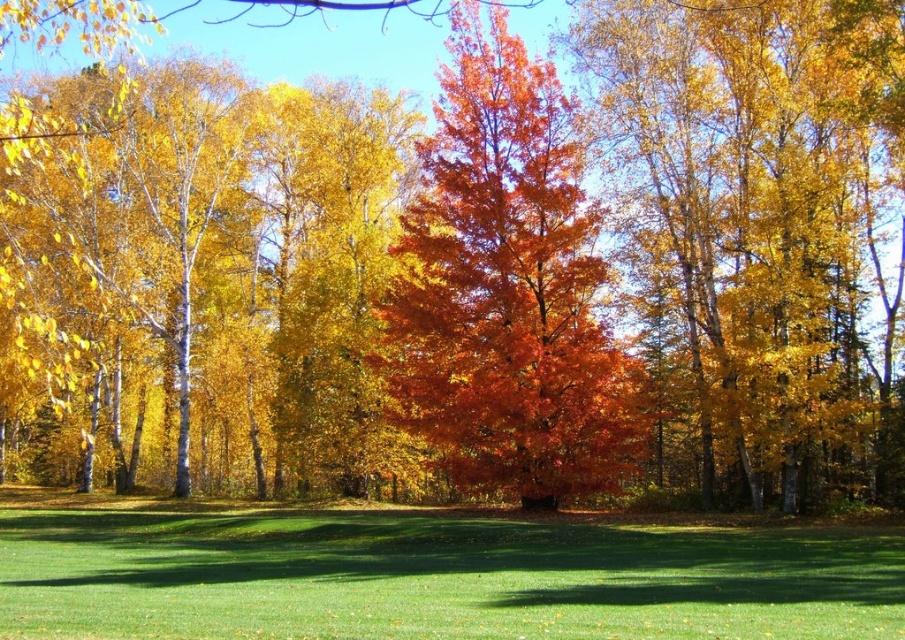
Question: Is green grass at center smaller than shiny orange leaves at center?

Choices:
 (A) yes
 (B) no

Answer: (A)

Question: Does green grass at center appear over shiny orange leaves at center?

Choices:
 (A) no
 (B) yes

Answer: (A)

Question: Which of the following is the farthest from the observer?

Choices:
 (A) (551, 365)
 (B) (632, 579)

Answer: (A)

Question: Does green grass at center have a lesser width compared to shiny orange leaves at center?

Choices:
 (A) yes
 (B) no

Answer: (B)

Question: Which of the following is the farthest from the observer?

Choices:
 (A) green grass at center
 (B) shiny orange leaves at center

Answer: (B)

Question: Which point is farther from the camera taking this photo?

Choices:
 (A) (121, 614)
 (B) (463, 426)

Answer: (B)